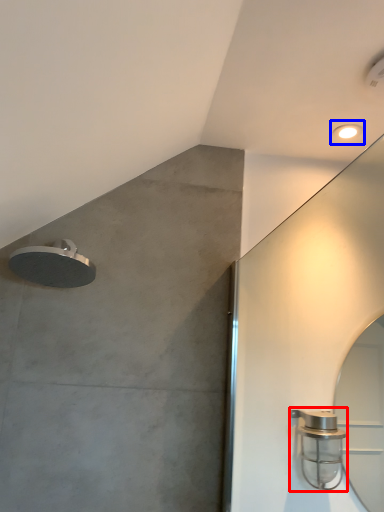
Question: Among these objects, which one is farthest to the camera, shower (highlighted by a red box) or droplight (highlighted by a blue box)?

Choices:
 (A) shower
 (B) droplight

Answer: (B)